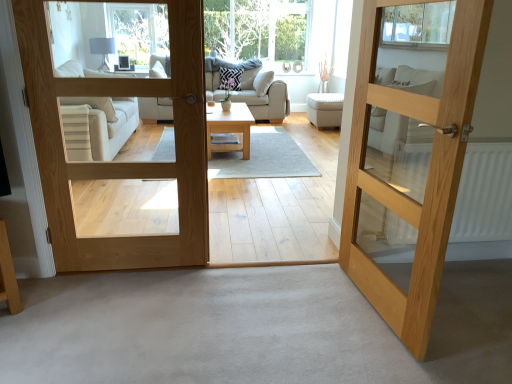
What do you see at coordinates (409, 152) in the screenshot? This screenshot has height=384, width=512. I see `natural wood door at center, which is the 2th door in left-to-right order` at bounding box center [409, 152].

The width and height of the screenshot is (512, 384). Describe the element at coordinates (484, 194) in the screenshot. I see `white textured radiator at right` at that location.

Identify the location of clear glass window at upper center. The image size is (512, 384). (258, 29).

Is beige fabric studio couch at center far away from natural wood door at center, marked as the second door in a right-to-left arrangement?

Yes, beige fabric studio couch at center and natural wood door at center, marked as the second door in a right-to-left arrangement, are located far from each other.

This screenshot has height=384, width=512. Identify the location of the 1st door below the beige fabric studio couch at center (from the image's perspective). (121, 162).

From the image's perspective, is beige fabric studio couch at center on natural wood door at center, marked as the 1th door in a left-to-right arrangement?

Indeed, from the image's perspective, beige fabric studio couch at center is shown above natural wood door at center, marked as the 1th door in a left-to-right arrangement.

Would you say natural wood door at center, marked as the second door in a right-to-left arrangement, is part of beige fabric studio couch at center's contents?

No, beige fabric studio couch at center does not contain natural wood door at center, marked as the second door in a right-to-left arrangement.

Is point (41, 126) closer to viewer compared to point (225, 132)?

Yes, it is.

Which object is more forward, natural wood door at center, marked as the second door in a right-to-left arrangement, or light wood coffee table at center?

natural wood door at center, marked as the second door in a right-to-left arrangement, is closer to the camera.

Does natural wood door at center, marked as the second door in a right-to-left arrangement, have a lesser height compared to light wood coffee table at center?

No, natural wood door at center, marked as the second door in a right-to-left arrangement, is not shorter than light wood coffee table at center.

Is natural wood door at center, which is the 2th door in left-to-right order, bigger than clear glass window at upper center?

No.

Is natural wood door at center, the first door viewed from the right, situated inside clear glass window at upper center or outside?

The correct answer is: outside.

The width and height of the screenshot is (512, 384). In order to click on door that is the 1st one below the clear glass window at upper center (from a real-world perspective) in this screenshot , I will do `click(409, 152)`.

Looking at this image, is there a large distance between beige fabric studio couch at center and clear glass window at upper center?

No, beige fabric studio couch at center is not far away from clear glass window at upper center.

From a real-world perspective, is beige fabric studio couch at center physically below clear glass window at upper center?

Indeed, from a real-world perspective, beige fabric studio couch at center is positioned beneath clear glass window at upper center.

Does beige fabric studio couch at center have a larger size compared to clear glass window at upper center?

Indeed, beige fabric studio couch at center has a larger size compared to clear glass window at upper center.

Which object is further away from the camera, beige fabric studio couch at center or clear glass window at upper center?

clear glass window at upper center is further away from the camera.

There is a beige fabric studio couch at center. Find the location of `the 2nd door below it (from the image's perspective)`. the 2nd door below it (from the image's perspective) is located at coordinates (409, 152).

Is beige fabric studio couch at center facing towards natural wood door at center, which is the 2th door in left-to-right order?

Yes, beige fabric studio couch at center is aimed at natural wood door at center, which is the 2th door in left-to-right order.

Are beige fabric studio couch at center and natural wood door at center, the first door viewed from the right, making contact?

No, beige fabric studio couch at center is not with natural wood door at center, the first door viewed from the right.

From a real-world perspective, is beige fabric studio couch at center on top of natural wood door at center, which is the 2th door in left-to-right order?

No.

Which object is further away from the camera, clear glass window at upper center or white fabric ottoman at center?

clear glass window at upper center is further from the camera.

From a real-world perspective, is clear glass window at upper center on white fabric ottoman at center?

Indeed, from a real-world perspective, clear glass window at upper center stands above white fabric ottoman at center.

Is clear glass window at upper center looking in the opposite direction of white fabric ottoman at center?

No.

Which is behind, point (292, 12) or point (308, 98)?

The point (308, 98) is behind.

Is clear glass window at upper center to the left or to the right of light wood coffee table at center in the image?

From the image, it's evident that clear glass window at upper center is to the left of light wood coffee table at center.

Can we say clear glass window at upper center lies outside light wood coffee table at center?

Indeed, clear glass window at upper center is completely outside light wood coffee table at center.

From a real-world perspective, is clear glass window at upper center physically above light wood coffee table at center?

Yes.

Who is shorter, clear glass window at upper center or light wood coffee table at center?

light wood coffee table at center is shorter.

Locate an element on the screen. This screenshot has height=384, width=512. the 1st door to the right of the beige fabric studio couch at center, counting from the anchor's position is located at coordinates (121, 162).

Find the location of a particular element. The width and height of the screenshot is (512, 384). table behind the natural wood door at center, marked as the 1th door in a left-to-right arrangement is located at coordinates (230, 128).

Based on their spatial positions, is clear glass window at upper center or beige fabric studio couch at center closer to natural wood door at center, marked as the 1th door in a left-to-right arrangement?

The object closer to natural wood door at center, marked as the 1th door in a left-to-right arrangement, is beige fabric studio couch at center.

From the image, which object appears to be farther from white textured radiator at right, clear glass window at upper center or natural wood door at center, marked as the second door in a right-to-left arrangement?

Among the two, clear glass window at upper center is located further to white textured radiator at right.

Looking at the image, which one is located closer to white textured radiator at right, beige fabric studio couch at center or natural wood door at center, which is the 2th door in left-to-right order?

natural wood door at center, which is the 2th door in left-to-right order, is closer to white textured radiator at right.

In the scene shown: From the image, which object appears to be nearer to natural wood door at center, marked as the 1th door in a left-to-right arrangement, white fabric ottoman at center or light wood coffee table at center?

light wood coffee table at center is positioned closer to the anchor natural wood door at center, marked as the 1th door in a left-to-right arrangement.

Estimate the real-world distances between objects in this image. Which object is closer to white textured radiator at right, natural wood door at center, which is the 2th door in left-to-right order, or natural wood door at center, marked as the second door in a right-to-left arrangement?

natural wood door at center, which is the 2th door in left-to-right order.

From the image, which object appears to be nearer to clear glass window at upper center, light wood coffee table at center or white fabric ottoman at center?

white fabric ottoman at center is positioned closer to the anchor clear glass window at upper center.

Estimate the real-world distances between objects in this image. Which object is closer to beige fabric studio couch at center, natural wood door at center, the first door viewed from the right, or light wood coffee table at center?

light wood coffee table at center.

Considering their positions, is light wood coffee table at center positioned closer to clear glass window at upper center than white textured radiator at right?

Among the two, light wood coffee table at center is located nearer to clear glass window at upper center.

At what (x,y) coordinates should I click in order to perform the action: click on table between natural wood door at center, marked as the second door in a right-to-left arrangement, and beige fabric studio couch at center from front to back. Please return your answer as a coordinate pair (x, y). This screenshot has height=384, width=512. Looking at the image, I should click on (230, 128).

What are the coordinates of `radiator between natural wood door at center, marked as the second door in a right-to-left arrangement, and beige fabric studio couch at center in the front-back direction` in the screenshot? It's located at (484, 194).

In order to click on studio couch between white textured radiator at right and clear glass window at upper center from front to back in this screenshot , I will do `click(264, 96)`.

This screenshot has width=512, height=384. Find the location of `radiator positioned between natural wood door at center, which is the 2th door in left-to-right order, and clear glass window at upper center from near to far`. radiator positioned between natural wood door at center, which is the 2th door in left-to-right order, and clear glass window at upper center from near to far is located at coordinates (484, 194).